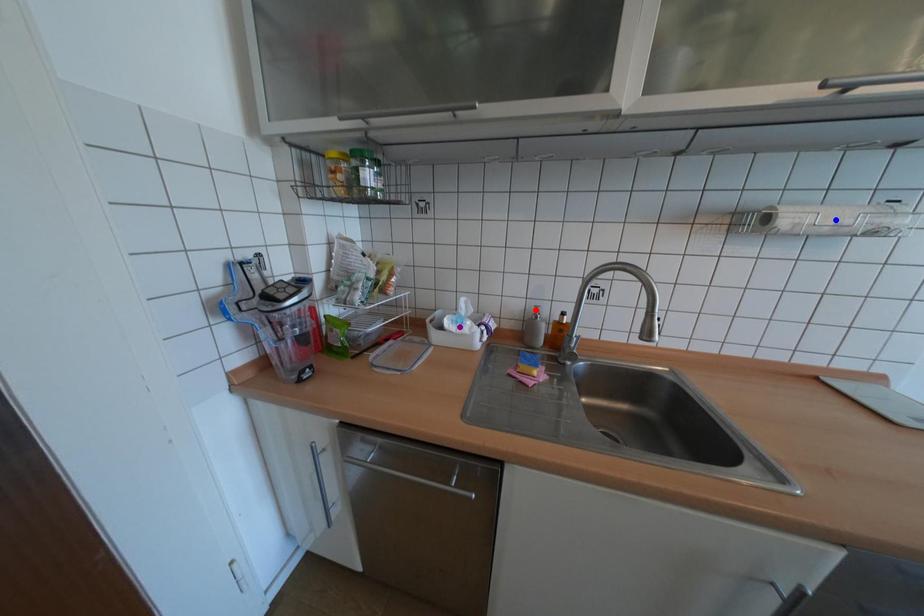
Order these from nearest to farthest:
purple point, red point, blue point

blue point → purple point → red point